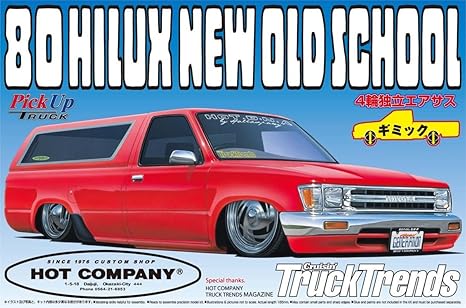
Find the location of `glass`. glass is located at coordinates (76, 152), (159, 145), (272, 144), (232, 140).